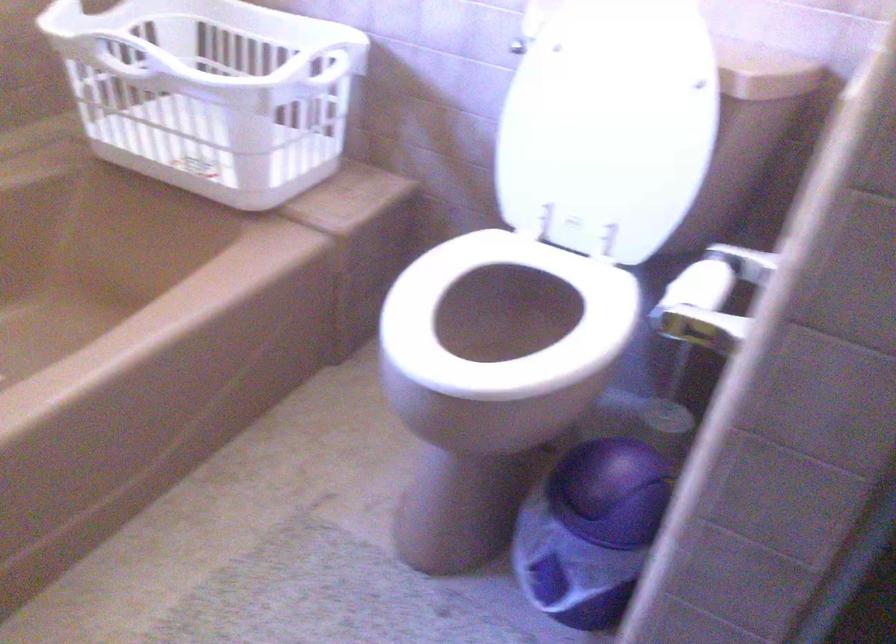
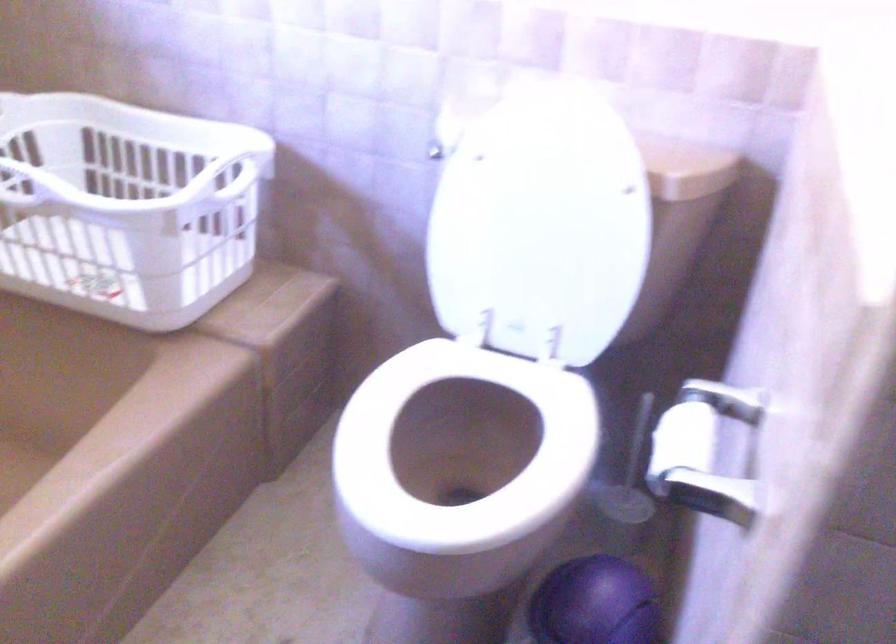
Where in the second image is the point corresponding to the point at 604,122 from the first image?

(539, 225)